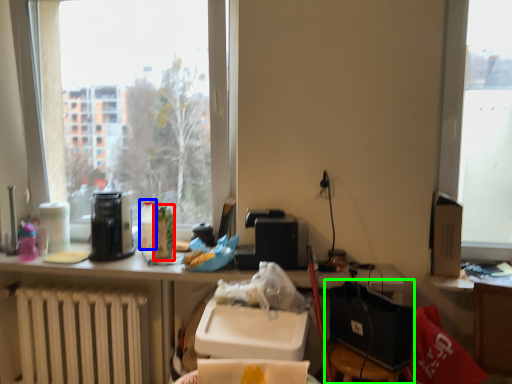
Question: Considering the real-world distances, which object is closest to bottle (highlighted by a red box)? bottle (highlighted by a blue box) or chair (highlighted by a green box).

Choices:
 (A) bottle
 (B) chair

Answer: (A)